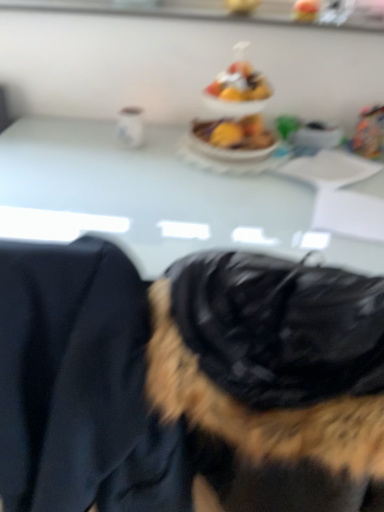
The height and width of the screenshot is (512, 384). Identify the location of vacant space situated on the left part of shiny plastic fruit bowl at center. (161, 150).